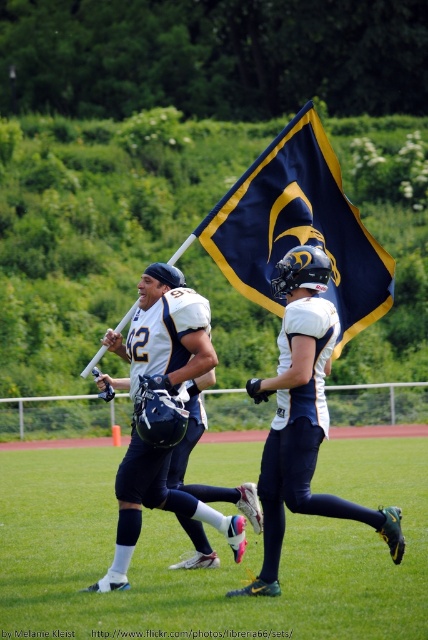
You are a spectator at the football game. You want to take a photo of the navy blue fabric flag at upper center without the green grass football field at center appearing in the background. Is this possible based on their positions?

The green grass football field at center is below the navy blue fabric flag at upper center, so if you position yourself to frame the flag higher in your viewfinder, you can exclude the field from the background by angling the camera upwards or moving closer to the flag.

Consider the image. You are a spectator at the football game and want to know which object is taller between the green grass football field at center and the navy blue fabric flag at upper center. Can you tell me which one is taller?

The navy blue fabric flag at upper center is taller than the green grass football field at center.

You are a sports analyst watching the game. You notice the navy blue fabric flag at upper center and the matte white helmet at center. Which object appears bigger in the image?

The navy blue fabric flag at upper center has a larger size compared to the matte white helmet at center, so the navy blue fabric flag at upper center appears bigger.